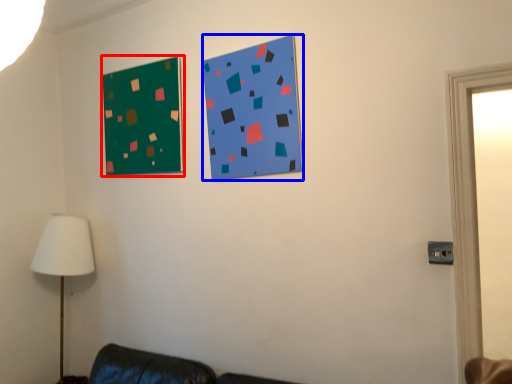
Question: Which object appears farthest to the camera in this image, bulletin board (highlighted by a red box) or bulletin board (highlighted by a blue box)?

Choices:
 (A) bulletin board
 (B) bulletin board

Answer: (A)